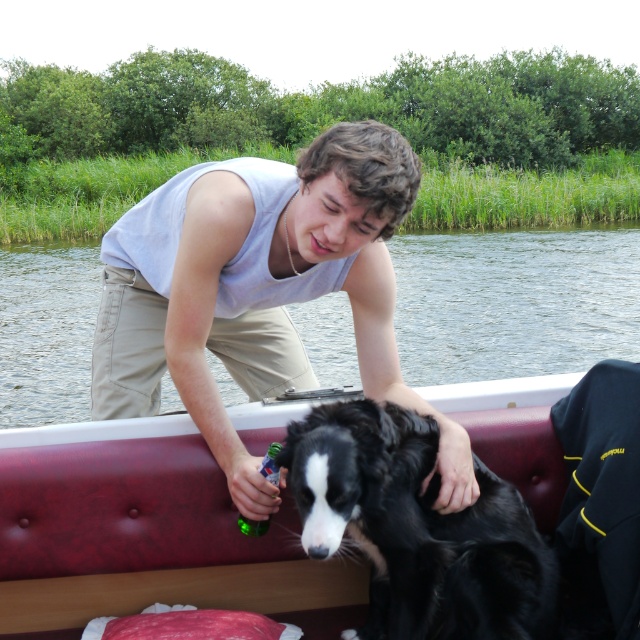
Question: Based on their relative distances, which object is farther from the gray cotton tank top at upper center?

Choices:
 (A) clear water at boat center
 (B) smooth leather boat at center

Answer: (A)

Question: Is smooth leather boat at center in front of black glossy fur at center?

Choices:
 (A) no
 (B) yes

Answer: (A)

Question: Which is nearer to the black glossy fur at center?

Choices:
 (A) clear water at boat center
 (B) gray cotton tank top at upper center

Answer: (B)

Question: Among these points, which one is nearest to the camera?

Choices:
 (A) (134, 611)
 (B) (163, 368)
 (C) (349, 412)

Answer: (C)

Question: Where is gray cotton tank top at upper center located in relation to black glossy fur at center in the image?

Choices:
 (A) above
 (B) below

Answer: (A)

Question: Is gray cotton tank top at upper center to the right of clear water at boat center from the viewer's perspective?

Choices:
 (A) no
 (B) yes

Answer: (B)